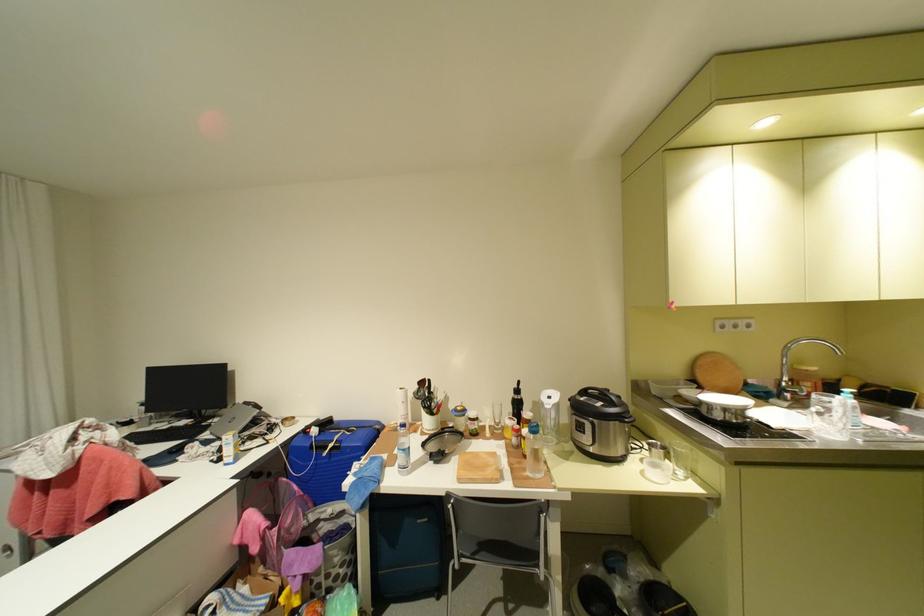
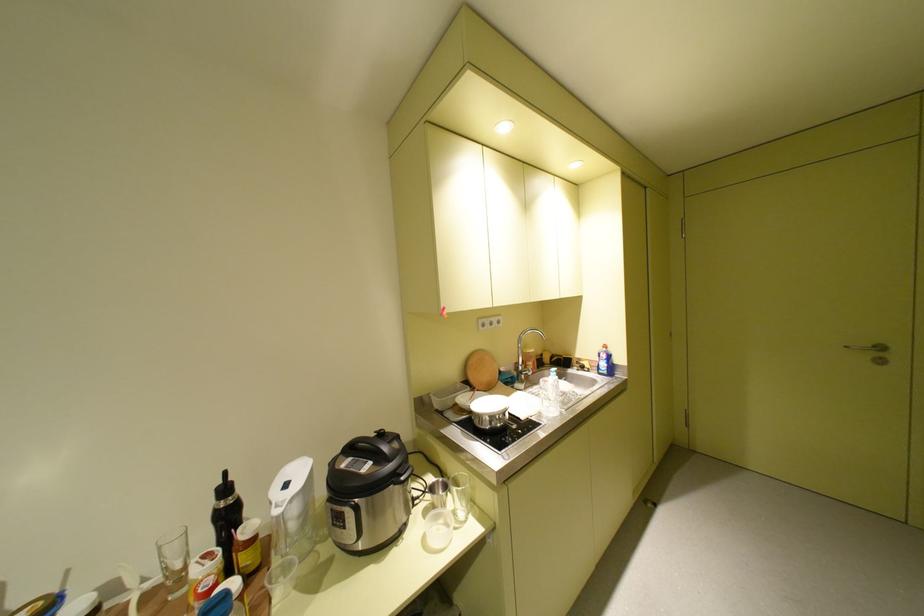
The point at (596,392) is marked in the first image. Where is the corresponding point in the second image?

(361, 448)